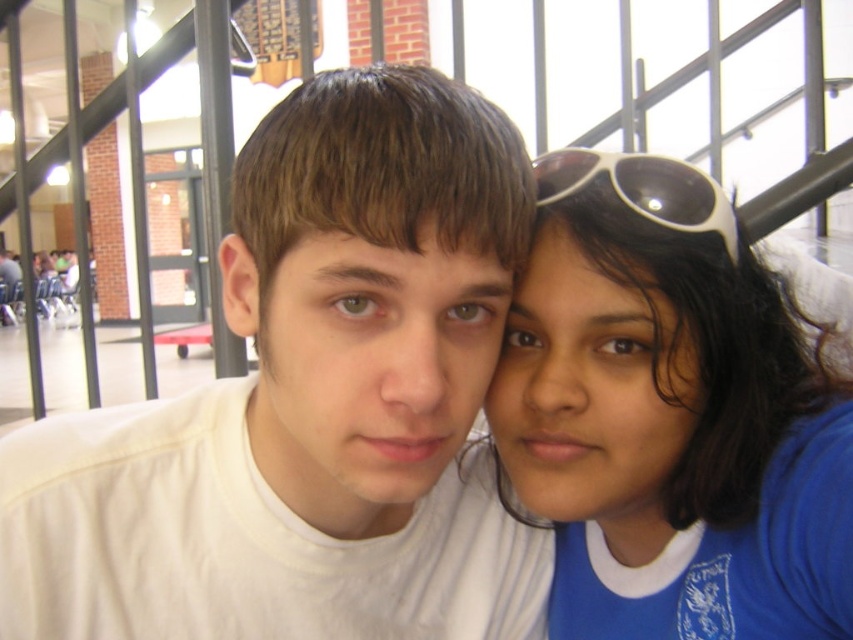
Does white matte t-shirt at center have a smaller size compared to white plastic sunglasses at upper right?

Actually, white matte t-shirt at center might be larger than white plastic sunglasses at upper right.

Which is behind, point (270, 333) or point (532, 164)?

Positioned behind is point (532, 164).

The image size is (853, 640). What are the coordinates of `white matte t-shirt at center` in the screenshot? It's located at (309, 403).

Does white matte t-shirt at center appear under blue fabric shirt at right?

Yes, white matte t-shirt at center is below blue fabric shirt at right.

Which is behind, point (479, 604) or point (770, 451)?

Point (479, 604)

Where is `white matte t-shirt at center`? white matte t-shirt at center is located at coordinates (309, 403).

The image size is (853, 640). What are the coordinates of `blue fabric shirt at right` in the screenshot? It's located at (671, 416).

Does blue fabric shirt at right have a smaller size compared to white plastic sunglasses at upper right?

Actually, blue fabric shirt at right might be larger than white plastic sunglasses at upper right.

The height and width of the screenshot is (640, 853). Describe the element at coordinates (671, 416) in the screenshot. I see `blue fabric shirt at right` at that location.

The height and width of the screenshot is (640, 853). In order to click on blue fabric shirt at right in this screenshot , I will do `click(671, 416)`.